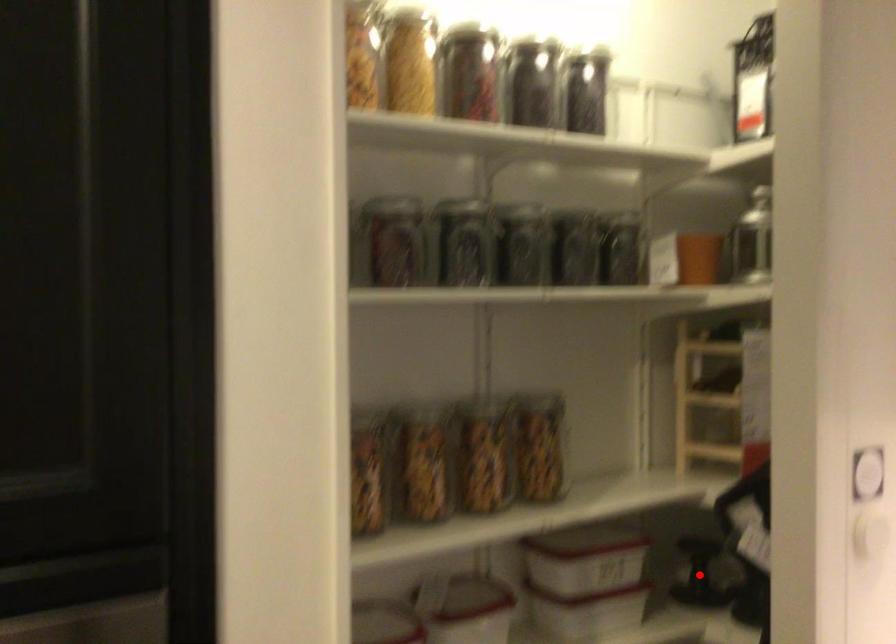
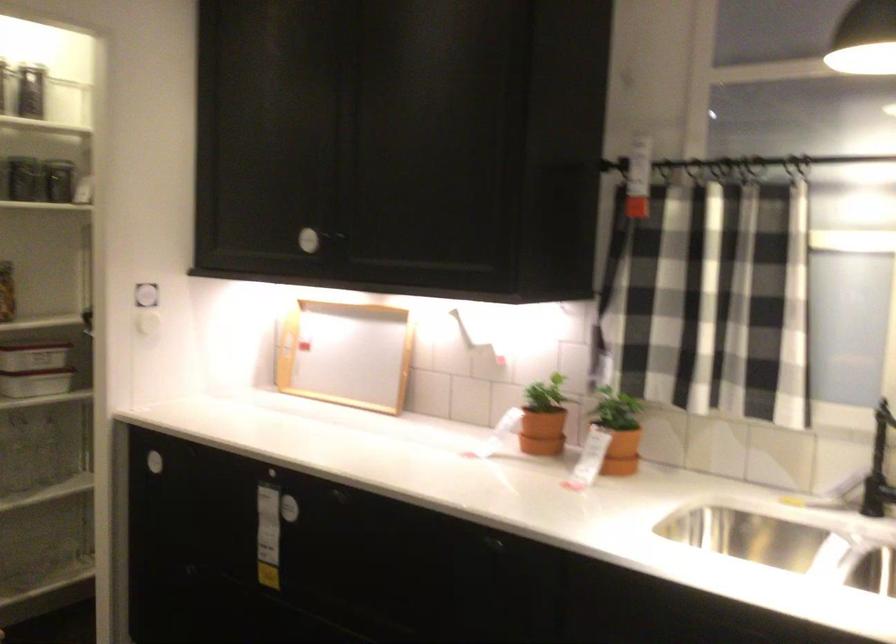
Question: I am providing you with two images of the same scene from different viewpoints. A red point is marked on the first image. Is the red point's position out of view in image 2?

Choices:
 (A) Yes
 (B) No

Answer: (A)